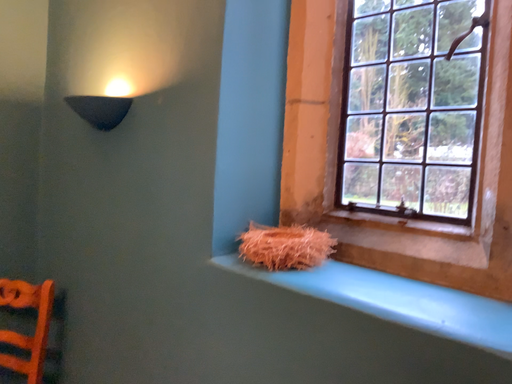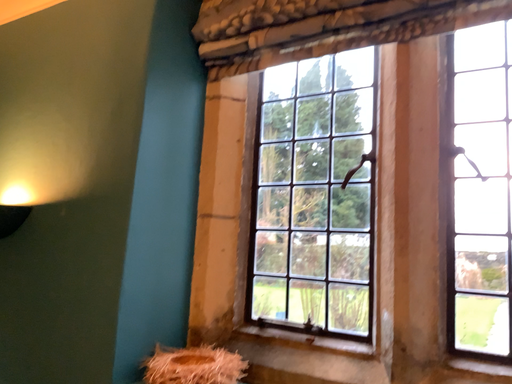
Question: Which way did the camera rotate in the video?

Choices:
 (A) rotated upward
 (B) rotated downward

Answer: (A)